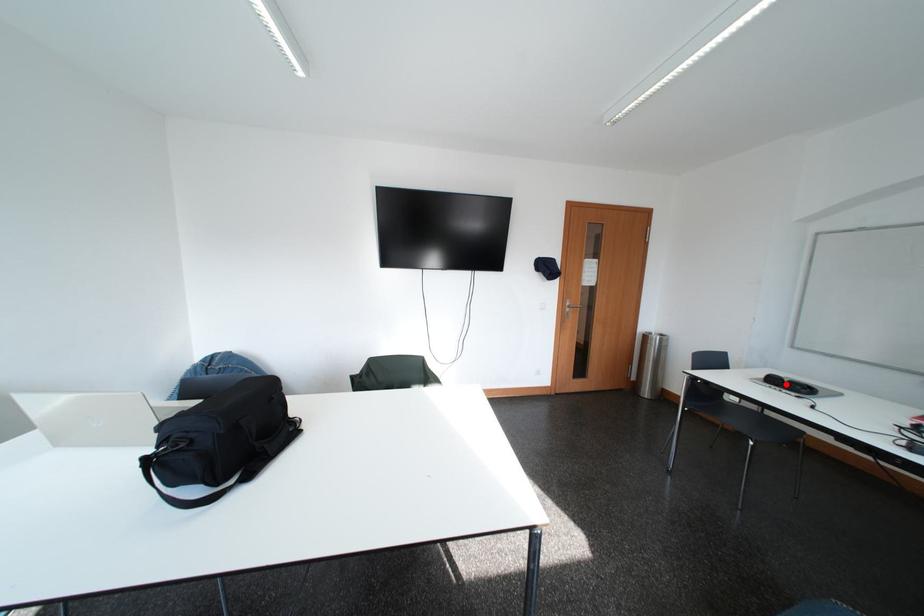
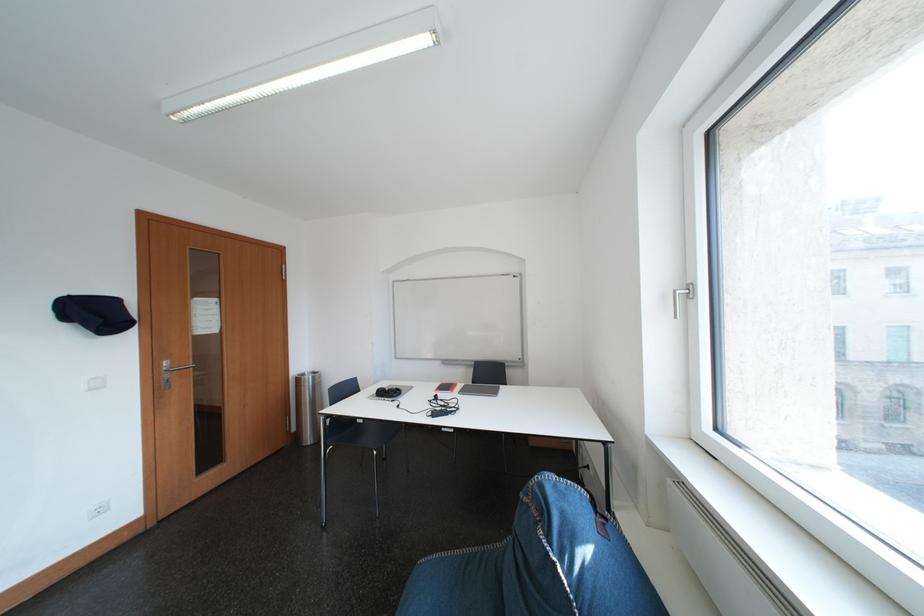
Question: I am providing you with two images of the same scene from different viewpoints. In image1, a red point is highlighted. Considering the same 3D point in image2, which of the following is correct?

Choices:
 (A) It is closer
 (B) It is farther

Answer: (A)